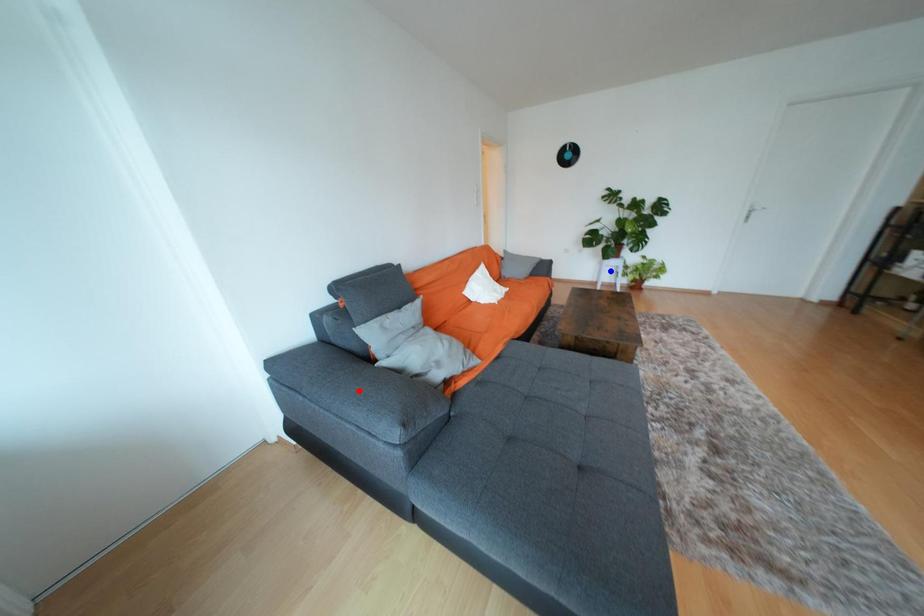
Question: Two points are marked on the image. Which point is closer to the camera?

Choices:
 (A) Blue point is closer.
 (B) Red point is closer.

Answer: (B)